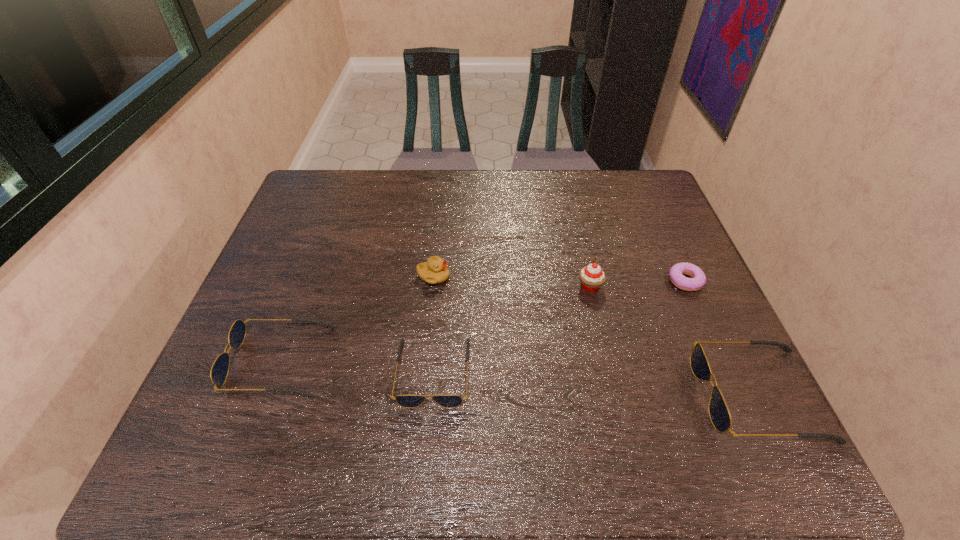
If the aim is uniform spacing by inserting an additional sunglasses among them, please point to a vacant space for this new sunglasses. Please provide its 2D coordinates. Your answer should be formatted as a tuple, i.e. [(x, y)], where the tuple contains the x and y coordinates of a point satisfying the conditions above.

[(592, 383)]